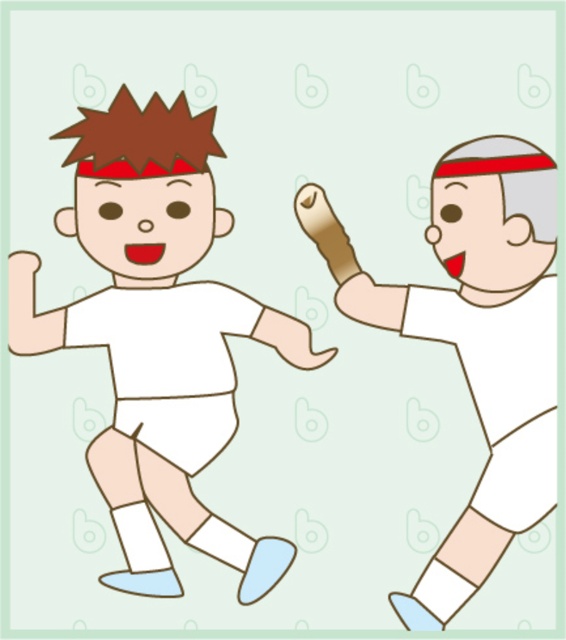
Who is shorter, white matte/soft boy at left or white matte/soft boy at right?

white matte/soft boy at right is shorter.

Find the location of a particular element. The image size is (566, 640). white matte/soft boy at left is located at coordinates (157, 336).

Who is more distant from viewer, (160, 284) or (350, 298)?

The point (160, 284) is more distant.

Where is `white matte/soft boy at left`? white matte/soft boy at left is located at coordinates (157, 336).